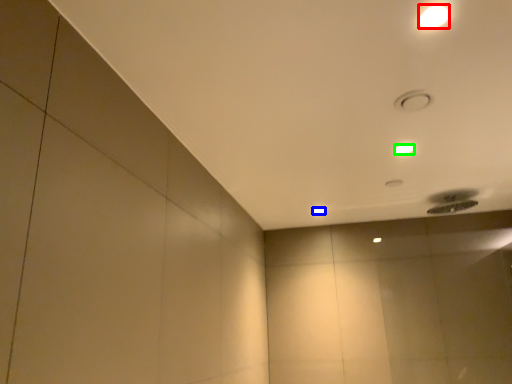
Question: Which object is the closest to the lamp (highlighted by a red box)? Choose among these: lamp (highlighted by a blue box) or lamp (highlighted by a green box).

Choices:
 (A) lamp
 (B) lamp

Answer: (B)